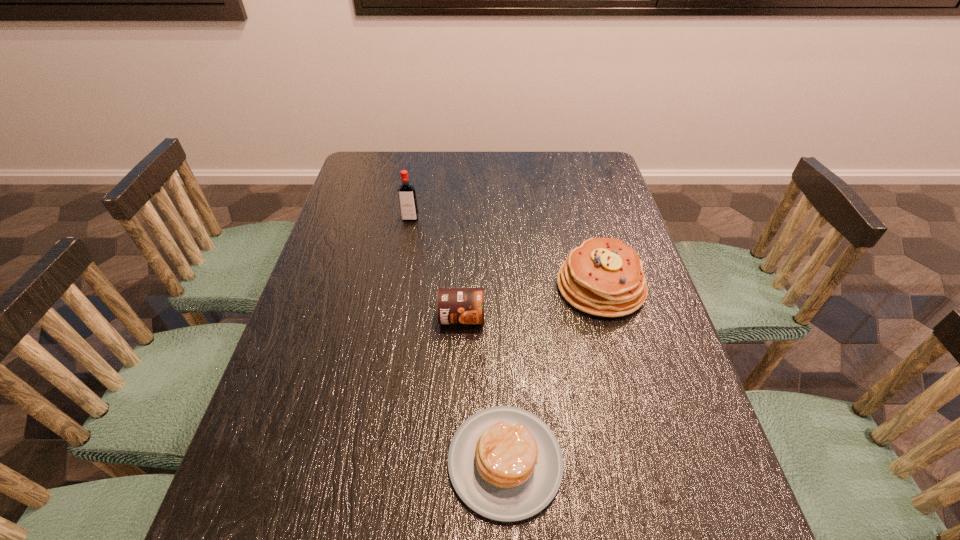
Where is `vacant area in the image that satisfies the following two spatial constraints: 1. on the front label of the left pancake; 2. on the left side of the second shortest object`? This screenshot has height=540, width=960. vacant area in the image that satisfies the following two spatial constraints: 1. on the front label of the left pancake; 2. on the left side of the second shortest object is located at coordinates (456, 461).

This screenshot has width=960, height=540. What are the coordinates of `free location that satisfies the following two spatial constraints: 1. on the front and back of the farthest object; 2. on the left side of the taller pancake` in the screenshot? It's located at (398, 287).

Where is `vacant space that satisfies the following two spatial constraints: 1. on the front label of the can; 2. on the right side of the shorter pancake`? vacant space that satisfies the following two spatial constraints: 1. on the front label of the can; 2. on the right side of the shorter pancake is located at coordinates pyautogui.click(x=456, y=461).

Find the location of `blank area in the image that satisfies the following two spatial constraints: 1. on the back side of the shorter pancake; 2. on the left side of the rightmost object`. blank area in the image that satisfies the following two spatial constraints: 1. on the back side of the shorter pancake; 2. on the left side of the rightmost object is located at coordinates click(x=498, y=287).

The image size is (960, 540). In order to click on vacant region that satisfies the following two spatial constraints: 1. on the front and back of the left pancake; 2. on the right side of the tallest object in this screenshot , I will do `click(367, 461)`.

At what (x,y) coordinates should I click in order to perform the action: click on free spot that satisfies the following two spatial constraints: 1. on the front and back of the tallest object; 2. on the right side of the third shortest object. Please return your answer as a coordinate pair (x, y). Image resolution: width=960 pixels, height=540 pixels. Looking at the image, I should click on (398, 287).

The image size is (960, 540). In order to click on vacant space that satisfies the following two spatial constraints: 1. on the front label of the nearest object; 2. on the left side of the can in this screenshot , I will do `click(456, 461)`.